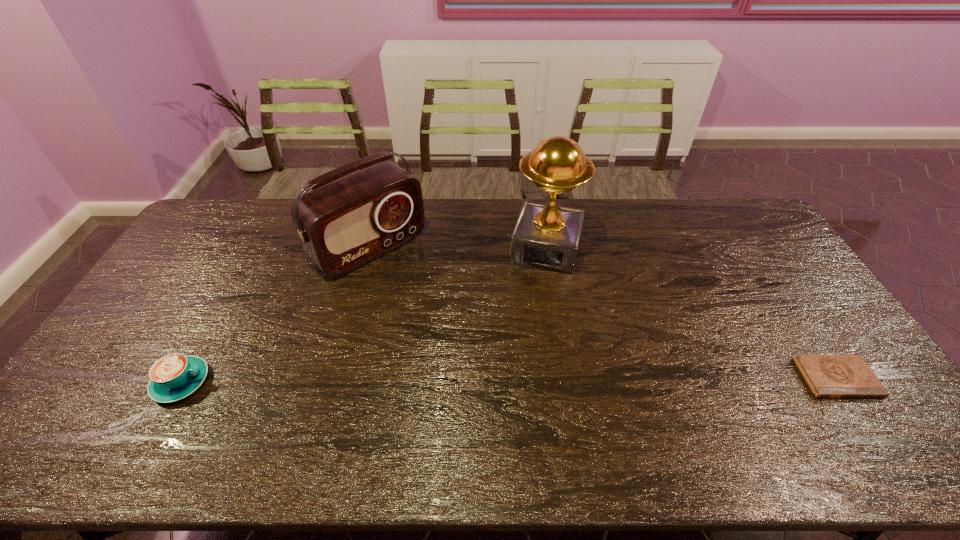
This screenshot has height=540, width=960. What are the coordinates of `free space on the desktop that is between the leftmost object and the shortest object and is positioned on the front-facing side of the award` in the screenshot? It's located at click(512, 380).

This screenshot has width=960, height=540. I want to click on vacant space on the desktop that is between the second shortest object and the diary and is positioned on the front panel of the second tallest object, so click(513, 380).